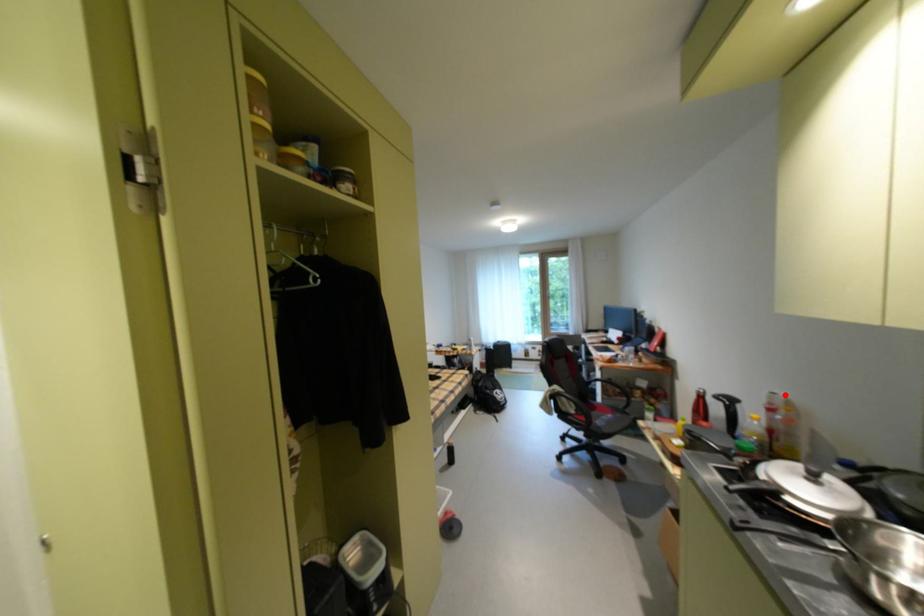
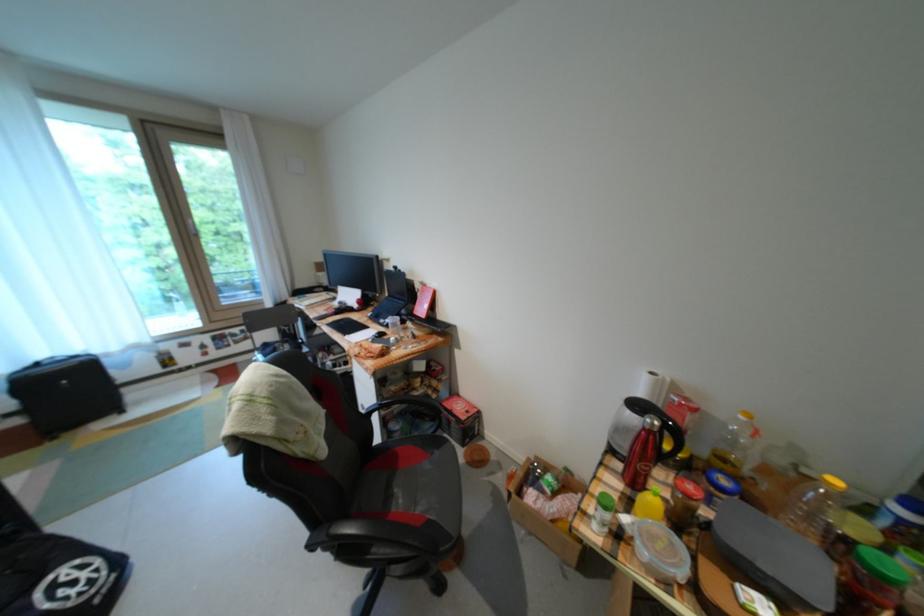
Locate, in the second image, the point that corresponds to the highlighted location in the first image.

(662, 374)